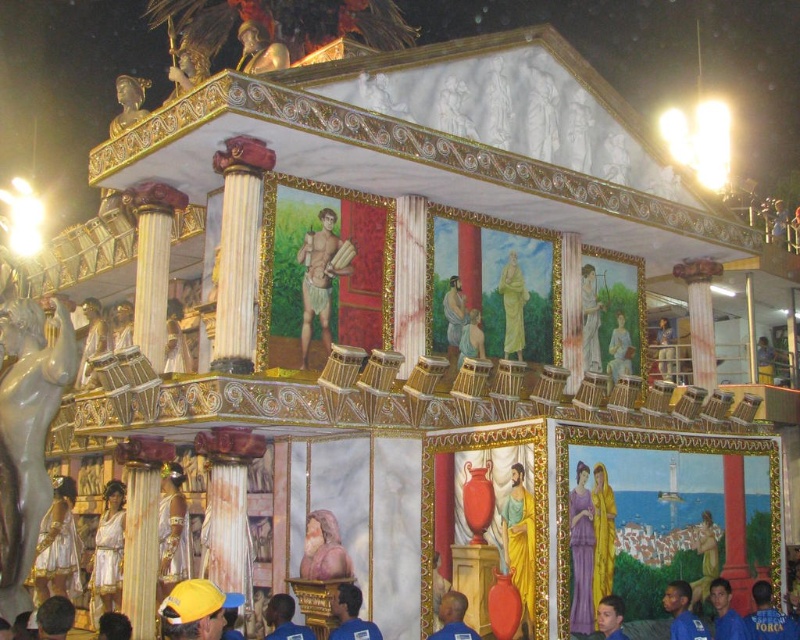
Question: Observing the image, what is the correct spatial positioning of golden fabric figure at center in reference to smooth beige statue at center?

Choices:
 (A) below
 (B) above

Answer: (A)

Question: Can you confirm if matte wooden figure at center is smaller than yellow fabric person at lower right?

Choices:
 (A) yes
 (B) no

Answer: (A)

Question: Among these points, which one is farthest from the camera?

Choices:
 (A) (505, 276)
 (B) (616, 365)
 (C) (524, 637)

Answer: (B)

Question: Observing the image, what is the correct spatial positioning of smooth white statue at upper center in reference to smooth white statue at upper right?

Choices:
 (A) right
 (B) left

Answer: (B)

Question: Which object is the closest to the gold metallic statue at upper center?

Choices:
 (A) golden statue at center
 (B) yellow fabric person at lower right
 (C) matte wooden figure at center
 (D) golden fabric figure at center

Answer: (C)

Question: Which point appears closest to the camera in this image?

Choices:
 (A) (580, 524)
 (B) (529, 596)
 (C) (588, 356)
 (D) (314, 294)

Answer: (B)